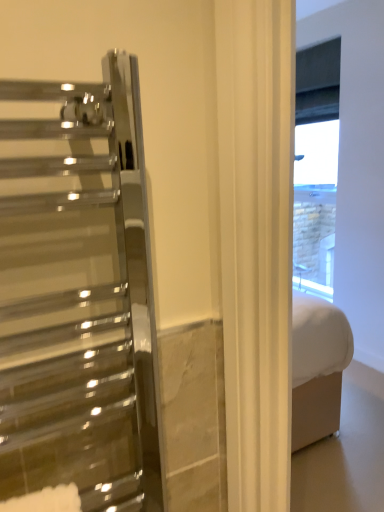
Question: Should I look upward or downward to see white brick wall at upper right?

Choices:
 (A) up
 (B) down

Answer: (A)